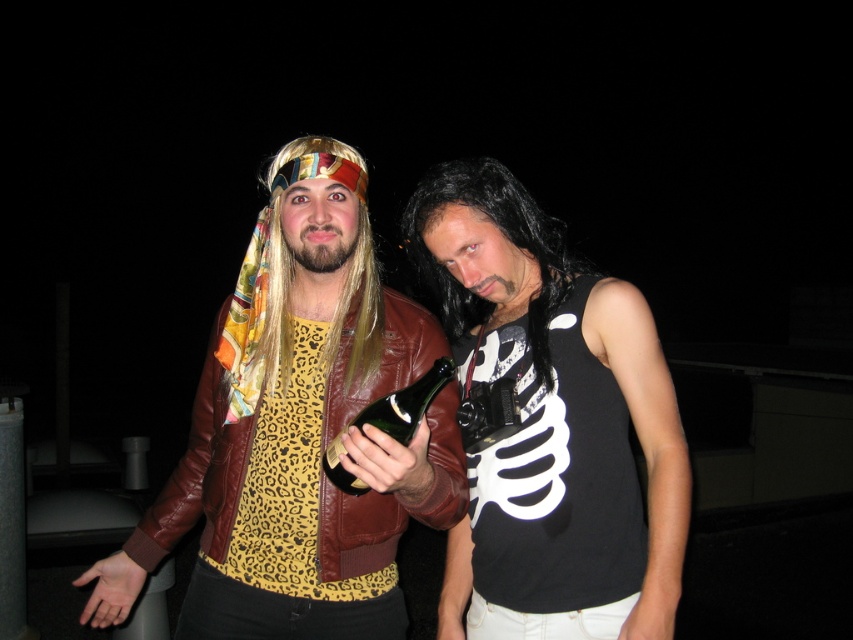
You are a photographer setting up a shot for a magazine cover. You need to ensure that the black matte tank top at center and the green glass bottle at center are both clearly visible in the frame. Based on their sizes, which object should you focus on first to ensure proper exposure?

The black matte tank top at center has a greater height compared to the green glass bottle at center, so you should focus on the black matte tank top at center first to ensure proper exposure since it is larger and might require more attention in the frame.